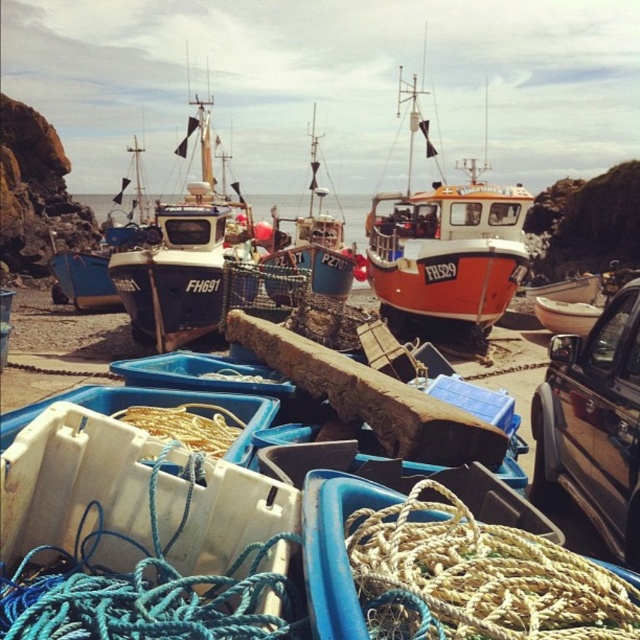
Question: Does blue painted wooden boat at center lie in front of white matte rope at center?

Choices:
 (A) yes
 (B) no

Answer: (B)

Question: Is natural beige rope at center thinner than black glossy truck at right?

Choices:
 (A) yes
 (B) no

Answer: (B)

Question: Is blue painted wooden boat at center bigger than blue rope at lower center?

Choices:
 (A) no
 (B) yes

Answer: (B)

Question: Based on their relative distances, which object is nearer to the black glossy truck at right?

Choices:
 (A) orange matte boat at center
 (B) blue painted wooden boat at center
 (C) blue rope at lower center

Answer: (C)

Question: Among these points, which one is nearest to the camera?

Choices:
 (A) (195, 438)
 (B) (628, 596)

Answer: (B)

Question: Which of the following is the farthest from the observer?

Choices:
 (A) (90, 259)
 (B) (182, 413)
 (C) (548, 374)
 (D) (392, 545)

Answer: (A)